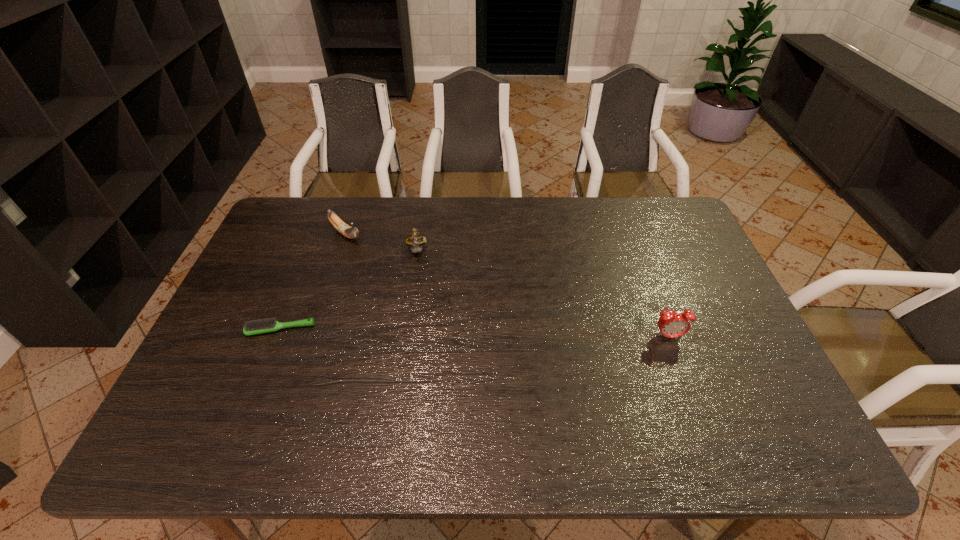
Image resolution: width=960 pixels, height=540 pixels. What are the coordinates of `the shortest object` in the screenshot? It's located at (260, 326).

I want to click on alarm clock, so [671, 324].

At what (x,y) coordinates should I click in order to perform the action: click on snail. Please return your answer as a coordinate pair (x, y). Looking at the image, I should click on (415, 239).

Identify the location of the third tallest object. This screenshot has height=540, width=960. (350, 232).

Where is `vacant area located on the back of the hairbrush`? vacant area located on the back of the hairbrush is located at coordinates (290, 305).

Find the location of `vacant space situated on the face of the rightmost object`. vacant space situated on the face of the rightmost object is located at coordinates (680, 367).

I want to click on free space located 0.090m on the face of the snail, so click(419, 285).

Where is `vacant region located 0.270m on the face of the snail`? vacant region located 0.270m on the face of the snail is located at coordinates [422, 332].

This screenshot has width=960, height=540. I want to click on free location located 0.090m on the face of the snail, so click(419, 285).

The height and width of the screenshot is (540, 960). I want to click on vacant space located 0.120m on the peel of the third tallest object, so click(x=376, y=261).